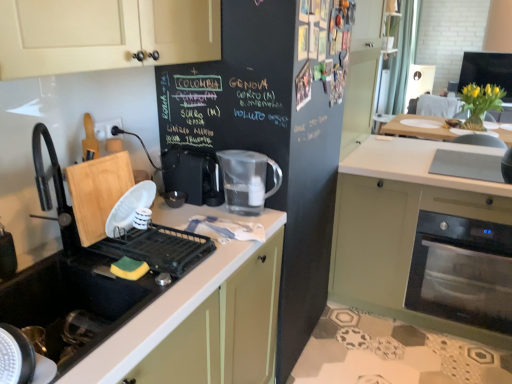
Question: Visually, is black rubber sink at lower left positioned to the left or to the right of green matte oven at lower right?

Choices:
 (A) left
 (B) right

Answer: (A)

Question: In the image, is black rubber sink at lower left positioned in front of or behind green matte oven at lower right?

Choices:
 (A) behind
 (B) front

Answer: (B)

Question: Which object is the closest to the black chalkboard at center?

Choices:
 (A) green matte oven at lower right
 (B) black rubber sink at lower left
 (C) transparent plastic pitcher at center
 (D) black plastic coffee machine at center
 (E) stainless steel oven at lower right

Answer: (C)

Question: Based on their relative distances, which object is nearer to the black chalkboard at center?

Choices:
 (A) green matte oven at lower right
 (B) black plastic coffee machine at center
 (C) black rubber sink at lower left
 (D) transparent plastic pitcher at center
 (E) stainless steel oven at lower right

Answer: (D)